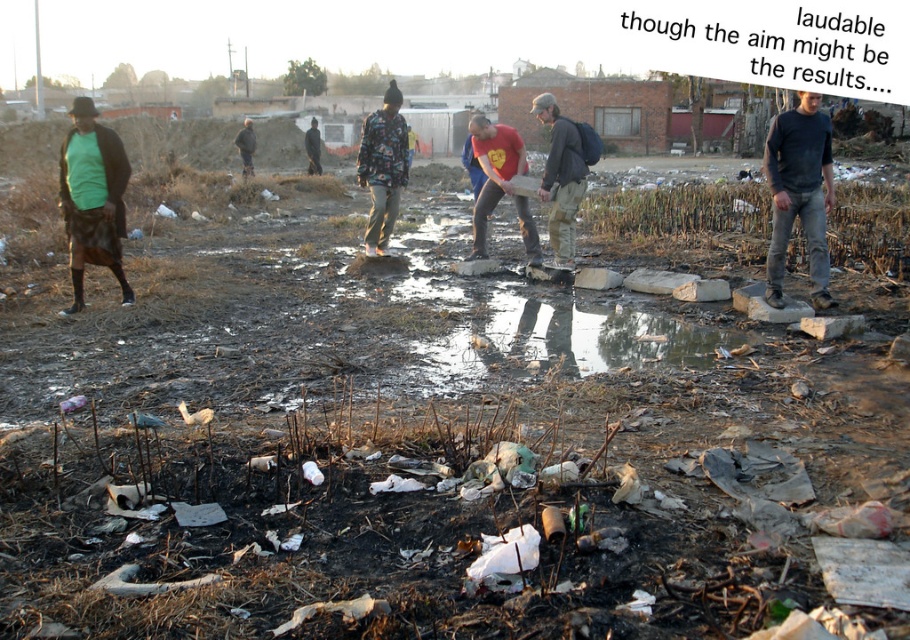
Question: Which object is the farthest from the red cotton shirt at center?

Choices:
 (A) dark green fabric jacket at center
 (B) dark gray t-shirt at center
 (C) glossy concrete puddle at center
 (D) matte gray jacket at center

Answer: (A)

Question: Does dark gray t-shirt at center appear on the right side of dark brown jacket at center?

Choices:
 (A) yes
 (B) no

Answer: (A)

Question: Is matte gray jacket at center above red cotton shirt at center?

Choices:
 (A) no
 (B) yes

Answer: (B)

Question: Estimate the real-world distances between objects in this image. Which object is farther from the glossy concrete puddle at center?

Choices:
 (A) dark gray t-shirt at center
 (B) dark green fabric jacket at center

Answer: (B)

Question: Is red cotton shirt at center bigger than dark brown jacket at center?

Choices:
 (A) no
 (B) yes

Answer: (A)

Question: Which object appears farthest from the camera in this image?

Choices:
 (A) matte gray jacket at center
 (B) dark brown jacket at center

Answer: (B)